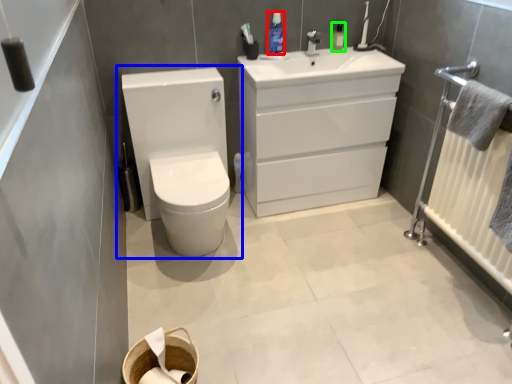
Question: Which object is positioned closest to mouthwash (highlighted by a red box)? Select from toilet (highlighted by a blue box) and mouthwash (highlighted by a green box).

Choices:
 (A) toilet
 (B) mouthwash

Answer: (B)